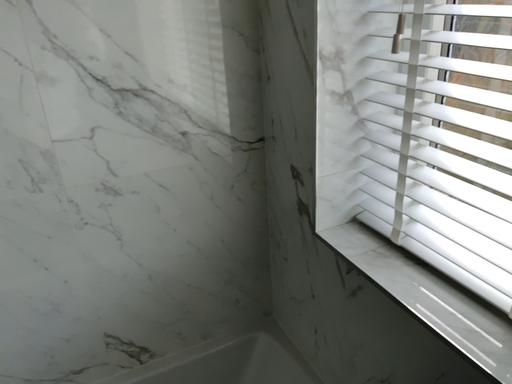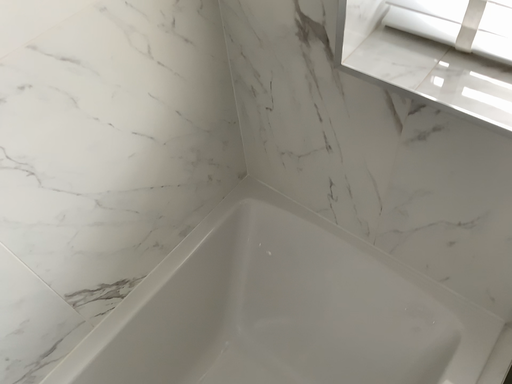
Question: Which way did the camera rotate in the video?

Choices:
 (A) rotated downward
 (B) rotated upward

Answer: (A)